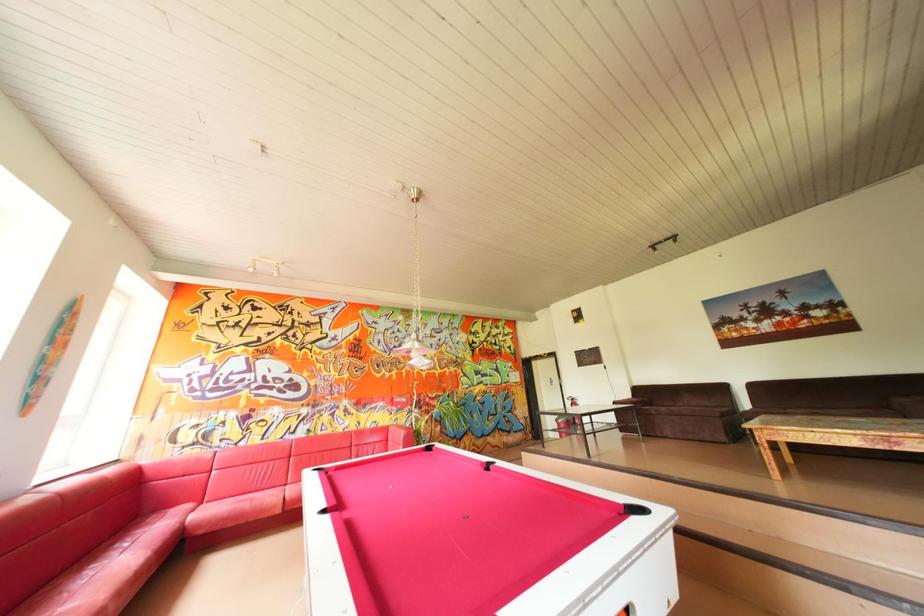
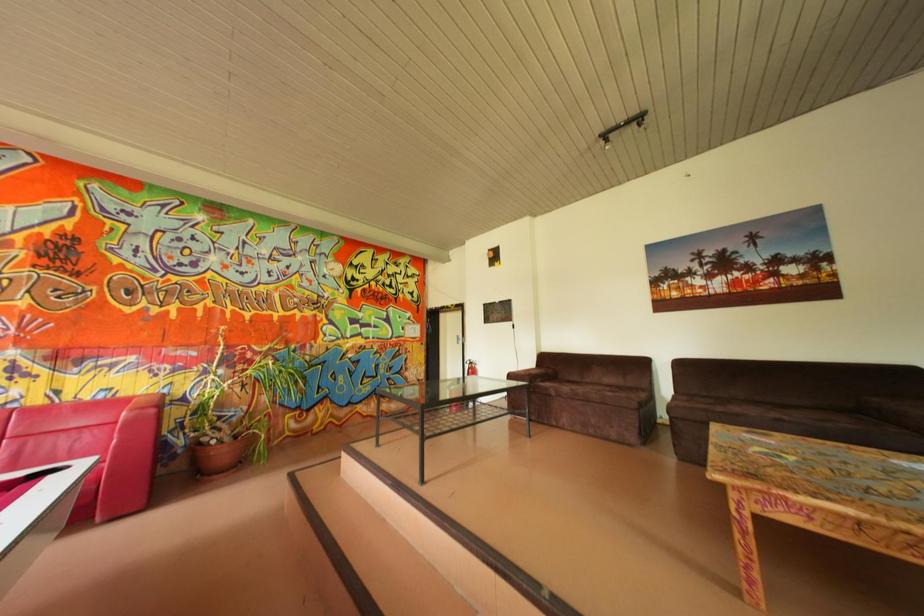
In a continuous first-person perspective shot, in which direction is the camera moving?

The cameraman moved toward right, forward.